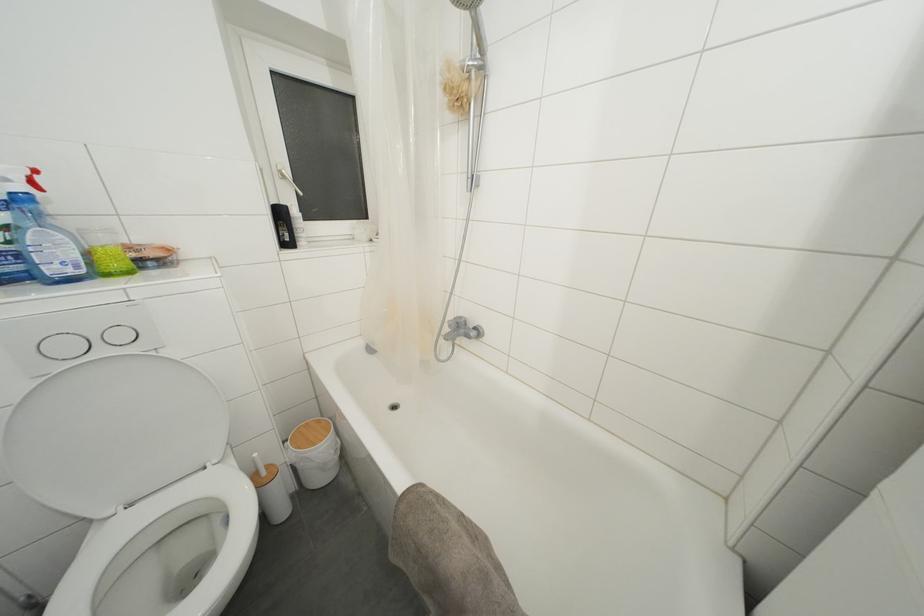
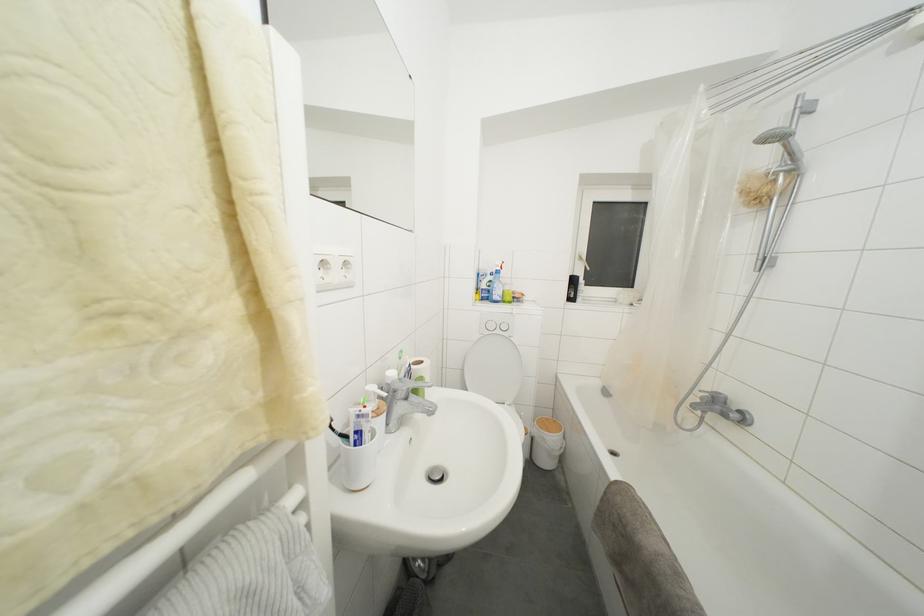
Locate, in the second image, the point that corresponds to the point at 285,219 in the first image.

(578, 286)